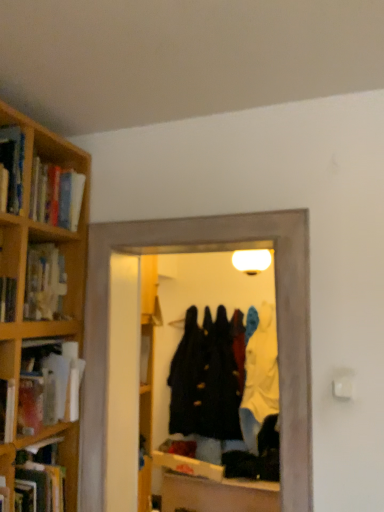
Question: From the image's perspective, is matte cardboard book at left, which is counted as the 1th book, starting from the top, located above velvet black coat at center, arranged as the 2th clothing when viewed from the right?

Choices:
 (A) yes
 (B) no

Answer: (A)

Question: From a real-world perspective, is matte cardboard book at left, which is counted as the 1th book, starting from the top, located beneath velvet black coat at center, which is counted as the 1th clothing, starting from the left?

Choices:
 (A) no
 (B) yes

Answer: (A)

Question: Is matte cardboard book at left, which is counted as the 1th book, starting from the top, directly adjacent to velvet black coat at center, arranged as the 2th clothing when viewed from the right?

Choices:
 (A) no
 (B) yes

Answer: (A)

Question: Can you confirm if matte cardboard book at left, which appears as the second book when ordered from the bottom, is bigger than velvet black coat at center, arranged as the 2th clothing when viewed from the right?

Choices:
 (A) no
 (B) yes

Answer: (A)

Question: Considering the relative sizes of matte cardboard book at left, which is counted as the 1th book, starting from the top, and velvet black coat at center, which is counted as the 1th clothing, starting from the left, in the image provided, is matte cardboard book at left, which is counted as the 1th book, starting from the top, shorter than velvet black coat at center, which is counted as the 1th clothing, starting from the left,?

Choices:
 (A) no
 (B) yes

Answer: (B)

Question: From the image's perspective, is transparent glass door at center above or below velvet black coat at center, arranged as the 2th clothing when viewed from the right?

Choices:
 (A) above
 (B) below

Answer: (A)

Question: Considering their positions, is transparent glass door at center located in front of or behind velvet black coat at center, which is counted as the 1th clothing, starting from the left?

Choices:
 (A) front
 (B) behind

Answer: (A)

Question: Is transparent glass door at center bigger or smaller than velvet black coat at center, which is counted as the 1th clothing, starting from the left?

Choices:
 (A) small
 (B) big

Answer: (A)

Question: From a real-world perspective, is transparent glass door at center positioned above or below velvet black coat at center, which is counted as the 1th clothing, starting from the left?

Choices:
 (A) above
 (B) below

Answer: (A)

Question: From the image's perspective, is matte cardboard book at left, which is counted as the 1th book, starting from the top, above or below velvet black coat at center, arranged as the 2th clothing when viewed from the right?

Choices:
 (A) above
 (B) below

Answer: (A)

Question: Would you say matte cardboard book at left, which is counted as the 1th book, starting from the top, is to the left or to the right of velvet black coat at center, arranged as the 2th clothing when viewed from the right, in the picture?

Choices:
 (A) right
 (B) left

Answer: (B)

Question: Considering the positions of matte cardboard book at left, which appears as the second book when ordered from the bottom, and velvet black coat at center, which is counted as the 1th clothing, starting from the left, in the image, is matte cardboard book at left, which appears as the second book when ordered from the bottom, bigger or smaller than velvet black coat at center, which is counted as the 1th clothing, starting from the left,?

Choices:
 (A) big
 (B) small

Answer: (B)

Question: Considering the positions of matte cardboard book at left, which is counted as the 1th book, starting from the top, and velvet black coat at center, which is counted as the 1th clothing, starting from the left, in the image, is matte cardboard book at left, which is counted as the 1th book, starting from the top, wider or thinner than velvet black coat at center, which is counted as the 1th clothing, starting from the left,?

Choices:
 (A) wide
 (B) thin

Answer: (B)

Question: Considering the positions of velvet black coat at center, which is counted as the 1th clothing, starting from the left, and transparent glass door at center in the image, is velvet black coat at center, which is counted as the 1th clothing, starting from the left, bigger or smaller than transparent glass door at center?

Choices:
 (A) small
 (B) big

Answer: (B)

Question: From a real-world perspective, is velvet black coat at center, arranged as the 2th clothing when viewed from the right, physically located above or below transparent glass door at center?

Choices:
 (A) below
 (B) above

Answer: (A)